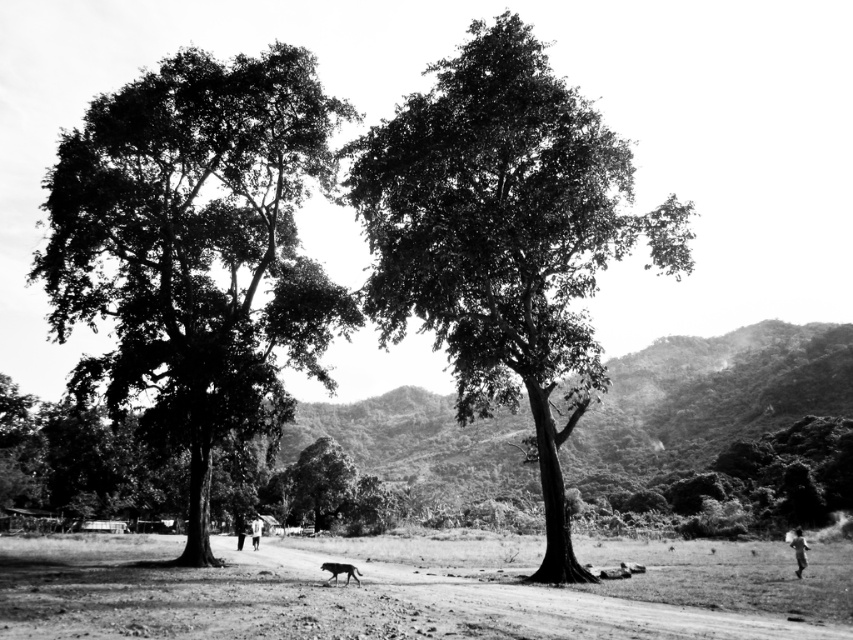
Looking at this image, who is positioned more to the right, smooth bark tree at center or gray fur dog at center?

smooth bark tree at center

Does point (517, 138) come behind point (341, 572)?

Yes, point (517, 138) is farther from viewer.

Find the location of a particular element. This screenshot has height=640, width=853. smooth bark tree at center is located at coordinates (503, 237).

This screenshot has width=853, height=640. I want to click on smooth bark tree at center, so click(503, 237).

Between dark skin human at lower right and gray fur dog at center, which one has more height?

Standing taller between the two is dark skin human at lower right.

The image size is (853, 640). What do you see at coordinates (798, 550) in the screenshot?
I see `dark skin human at lower right` at bounding box center [798, 550].

In the scene shown: Who is more forward, (802, 538) or (323, 568)?

Point (323, 568) is in front.

Find the location of a particular element. The image size is (853, 640). dark skin human at lower right is located at coordinates (798, 550).

In the scene shown: Between dark green leafy tree at left and white cotton shirt at center, which one appears on the right side from the viewer's perspective?

white cotton shirt at center

Between dark green leafy tree at left and white cotton shirt at center, which one is positioned lower?

white cotton shirt at center is below.

Between point (68, 317) and point (252, 529), which one is positioned in front?

Point (68, 317) is in front.

Find the location of `dark green leafy tree at left`. dark green leafy tree at left is located at coordinates (196, 250).